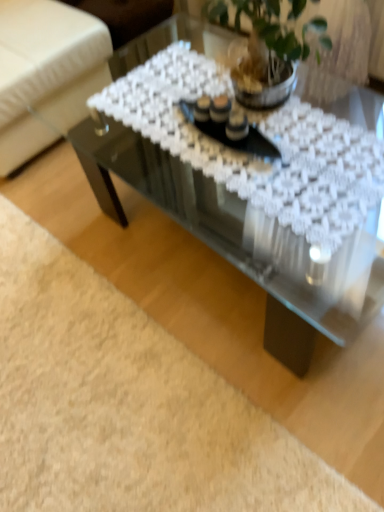
I want to click on free spot above clear glass plate at center (from a real-world perspective), so click(x=214, y=119).